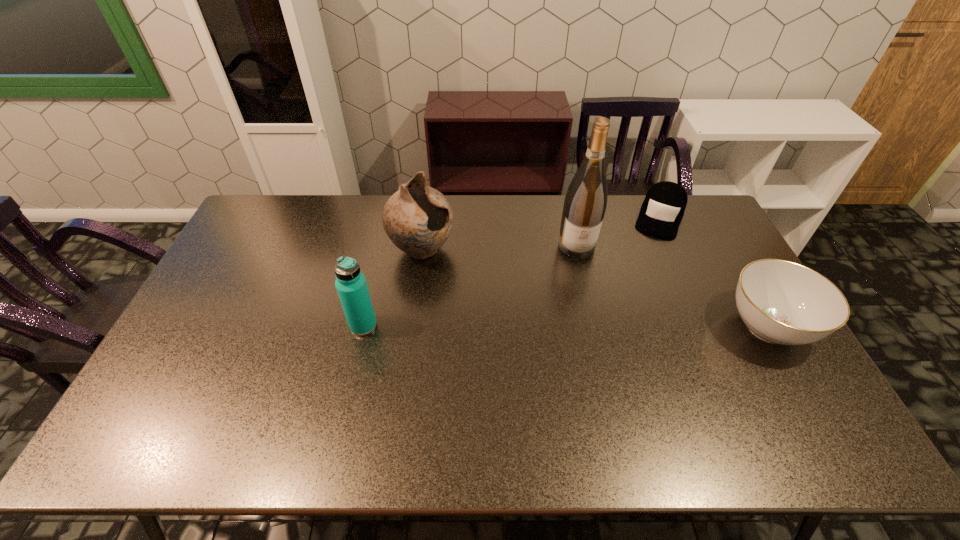
Image resolution: width=960 pixels, height=540 pixels. Find the location of `vacant space on the desktop that is between the third tallest object and the fourth tallest object and is positioned on the label of the wine bottle`. vacant space on the desktop that is between the third tallest object and the fourth tallest object and is positioned on the label of the wine bottle is located at coordinates (591, 326).

This screenshot has width=960, height=540. In order to click on free space on the desktop that is between the third shortest object and the second shortest object and is positioned from the spout of the pottery in this screenshot , I will do `click(534, 326)`.

Identify the location of vacant space on the desktop that is between the water bottle and the fourth tallest object and is positioned on the front-facing side of the shortest object. This screenshot has width=960, height=540. click(x=619, y=326).